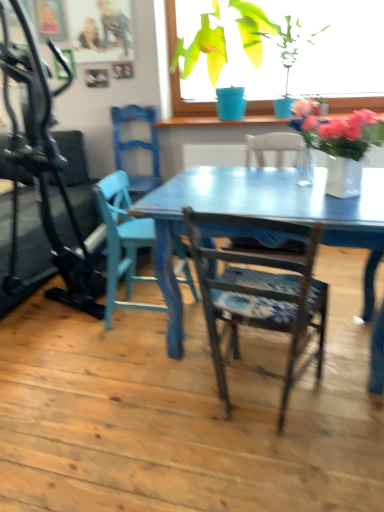
What do you see at coordinates (337, 130) in the screenshot? I see `white glossy vase at upper right, the 2th flower viewed from the right` at bounding box center [337, 130].

You are a GUI agent. You are given a task and a screenshot of the screen. Output one action in this format:
    pyautogui.click(x=<x>, y=<y>)
    Task: Click on the matte blue chair at left, the 3th chair viewed from the front
    The image size is (384, 512).
    Given the screenshot: What is the action you would take?
    pyautogui.click(x=137, y=145)

What is the approximate width of matte blue chair at left, the first chair viewed from the back?

19.34 inches.

What do you see at coordinates (195, 58) in the screenshot? This screenshot has width=384, height=512. I see `green matte plant pot at upper center, the second houseplant viewed from the right` at bounding box center [195, 58].

This screenshot has height=512, width=384. What are the coordinates of `green matte plant pot at upper center, the 1th houseplant from the left` in the screenshot? It's located at (195, 58).

You are a GUI agent. You are given a task and a screenshot of the screen. Output one action in this format:
    pyautogui.click(x=<x>, y=<y>)
    Task: Click on the blue painted wood chair at center, which is the 3th chair in back-to-front order
    The width and height of the screenshot is (384, 512).
    Given the screenshot: What is the action you would take?
    pyautogui.click(x=259, y=295)

Describe the element at coordinates (288, 47) in the screenshot. I see `green glossy plant at upper center, arranged as the 2th houseplant when viewed from the left` at that location.

Locate an element on the screen. This screenshot has width=384, height=512. green glossy plant at upper center, arranged as the 2th houseplant when viewed from the left is located at coordinates (288, 47).

Image resolution: width=384 pixels, height=512 pixels. Identify the location of black rubber treadmill at left. (44, 167).

From a real-world perspective, which object rests below the other?

matte blue chair at center, the second chair from the front, from a real-world perspective.

Consider the image. Is matte blue chair at center, the second chair from the back, situated inside green matte plant pot at upper center, the second houseplant viewed from the right, or outside?

matte blue chair at center, the second chair from the back, cannot be found inside green matte plant pot at upper center, the second houseplant viewed from the right.

Are matte blue chair at center, the second chair from the back, and green matte plant pot at upper center, the 1th houseplant from the left, making contact?

No, matte blue chair at center, the second chair from the back, is not with green matte plant pot at upper center, the 1th houseplant from the left.

Is matte blue chair at left, the 3th chair viewed from the front, inside the boundaries of green matte plant pot at upper center, the 1th houseplant from the left, or outside?

matte blue chair at left, the 3th chair viewed from the front, cannot be found inside green matte plant pot at upper center, the 1th houseplant from the left.

Is point (151, 145) less distant than point (257, 29)?

No.

From their relative heights in the image, would you say matte blue chair at left, the 3th chair viewed from the front, is taller or shorter than green matte plant pot at upper center, the second houseplant viewed from the right?

Considering their sizes, matte blue chair at left, the 3th chair viewed from the front, has less height than green matte plant pot at upper center, the second houseplant viewed from the right.

Is matte blue chair at left, the first chair viewed from the back, to the right of green matte plant pot at upper center, the second houseplant viewed from the right, from the viewer's perspective?

Incorrect, matte blue chair at left, the first chair viewed from the back, is not on the right side of green matte plant pot at upper center, the second houseplant viewed from the right.

Considering the sizes of objects matte blue chair at center, the second chair from the back, and blue painted wood chair at center, positioned as the 1th chair in front-to-back order, in the image provided, who is taller, matte blue chair at center, the second chair from the back, or blue painted wood chair at center, positioned as the 1th chair in front-to-back order,?

With more height is blue painted wood chair at center, positioned as the 1th chair in front-to-back order.

From the image's perspective, does matte blue chair at center, the second chair from the back, appear higher than blue painted wood chair at center, which is the 3th chair in back-to-front order?

Yes, from the image's perspective, matte blue chair at center, the second chair from the back, is on top of blue painted wood chair at center, which is the 3th chair in back-to-front order.

Can we say matte blue chair at center, the second chair from the back, lies outside blue painted wood chair at center, which is the 3th chair in back-to-front order?

Absolutely, matte blue chair at center, the second chair from the back, is external to blue painted wood chair at center, which is the 3th chair in back-to-front order.

Would you say green matte plant pot at upper center, the second houseplant viewed from the right, is inside or outside green glossy plant at upper center, arranged as the 2th houseplant when viewed from the left?

green matte plant pot at upper center, the second houseplant viewed from the right, can be found inside green glossy plant at upper center, arranged as the 2th houseplant when viewed from the left.

Based on their positions, is green matte plant pot at upper center, the second houseplant viewed from the right, located to the left or right of green glossy plant at upper center, which is counted as the first houseplant, starting from the right?

green matte plant pot at upper center, the second houseplant viewed from the right, is positioned on green glossy plant at upper center, which is counted as the first houseplant, starting from the right,'s left side.

From a real-world perspective, who is located higher, green matte plant pot at upper center, the second houseplant viewed from the right, or green glossy plant at upper center, arranged as the 2th houseplant when viewed from the left?

In real-world perspective, green matte plant pot at upper center, the second houseplant viewed from the right, is above.

Does point (193, 103) come farther from viewer compared to point (291, 52)?

Yes, it is.

How different are the orientations of black rubber treadmill at left and green matte plant pot at upper center, the 1th houseplant from the left, in degrees?

The angular difference between black rubber treadmill at left and green matte plant pot at upper center, the 1th houseplant from the left, is 0.413 degrees.

Considering the sizes of black rubber treadmill at left and green matte plant pot at upper center, the second houseplant viewed from the right, in the image, is black rubber treadmill at left taller or shorter than green matte plant pot at upper center, the second houseplant viewed from the right,?

In the image, black rubber treadmill at left appears to be taller than green matte plant pot at upper center, the second houseplant viewed from the right.

Is black rubber treadmill at left placed right next to green matte plant pot at upper center, the 1th houseplant from the left?

black rubber treadmill at left is not next to green matte plant pot at upper center, the 1th houseplant from the left, and they're not touching.

Is black rubber treadmill at left situated inside green matte plant pot at upper center, the 1th houseplant from the left, or outside?

black rubber treadmill at left is spatially situated outside green matte plant pot at upper center, the 1th houseplant from the left.

How far apart are white glossy vase at upper right, arranged as the 1th flower when viewed from the front, and green matte plant pot at upper center, the 1th houseplant from the left?

white glossy vase at upper right, arranged as the 1th flower when viewed from the front, and green matte plant pot at upper center, the 1th houseplant from the left, are 4.97 feet apart from each other.

From the image's perspective, is white glossy vase at upper right, the 2th flower viewed from the right, located above green matte plant pot at upper center, the 1th houseplant from the left?

No, from the image's perspective, white glossy vase at upper right, the 2th flower viewed from the right, is not above green matte plant pot at upper center, the 1th houseplant from the left.

Between white glossy vase at upper right, which ranks as the 1th flower in left-to-right order, and green matte plant pot at upper center, the 1th houseplant from the left, which one has larger width?

Wider between the two is green matte plant pot at upper center, the 1th houseplant from the left.

Is green matte plant pot at upper center, the second houseplant viewed from the right, located within white glossy vase at upper right, which ranks as the 1th flower in left-to-right order?

Definitely not — green matte plant pot at upper center, the second houseplant viewed from the right, is not inside white glossy vase at upper right, which ranks as the 1th flower in left-to-right order.

In the scene shown: Could you tell me if green matte plant pot at upper center, the second houseplant viewed from the right, is facing matte blue chair at center, the second chair from the front?

Yes, green matte plant pot at upper center, the second houseplant viewed from the right, is oriented towards matte blue chair at center, the second chair from the front.

Is green matte plant pot at upper center, the second houseplant viewed from the right, bigger than matte blue chair at center, the second chair from the back?

Yes.

In the scene shown: Which object is thinner, green matte plant pot at upper center, the 1th houseplant from the left, or matte blue chair at center, the second chair from the front?

matte blue chair at center, the second chair from the front.

Starting from the matte blue chair at center, the second chair from the front, which houseplant is the 1st one to the right? Please provide its 2D coordinates.

[(195, 58)]

Image resolution: width=384 pixels, height=512 pixels. I want to click on houseplant that is the 2nd object located behind the matte blue chair at center, the second chair from the front, so click(195, 58).

The width and height of the screenshot is (384, 512). I want to click on the 2nd houseplant above the matte blue chair at left, the 3th chair viewed from the front (from the image's perspective), so click(x=195, y=58).

Estimate the real-world distances between objects in this image. Which object is closer to matte blue chair at left, the 3th chair viewed from the front, pink matte vase at upper center, positioned as the second flower in front-to-back order, or white glossy vase at upper right, placed as the 1th flower when sorted from bottom to top?

Among the two, pink matte vase at upper center, positioned as the second flower in front-to-back order, is located nearer to matte blue chair at left, the 3th chair viewed from the front.

Considering their positions, is black rubber treadmill at left positioned closer to green matte plant pot at upper center, the 1th houseplant from the left, than matte blue chair at center, the second chair from the front?

The object closer to green matte plant pot at upper center, the 1th houseplant from the left, is black rubber treadmill at left.

Looking at the image, which one is located further to blue painted wood chair at center, which is the 3th chair in back-to-front order, matte blue chair at left, the 3th chair viewed from the front, or matte blue chair at center, the second chair from the front?

The object further to blue painted wood chair at center, which is the 3th chair in back-to-front order, is matte blue chair at left, the 3th chair viewed from the front.

Estimate the real-world distances between objects in this image. Which object is further from green glossy plant at upper center, arranged as the 2th houseplant when viewed from the left, blue painted wood chair at center, which is the 3th chair in back-to-front order, or green matte plant pot at upper center, the 1th houseplant from the left?

Based on the image, blue painted wood chair at center, which is the 3th chair in back-to-front order, appears to be further to green glossy plant at upper center, arranged as the 2th houseplant when viewed from the left.

Looking at the image, which one is located further to green glossy plant at upper center, arranged as the 2th houseplant when viewed from the left, blue painted wood chair at center, positioned as the 1th chair in front-to-back order, or matte blue chair at left, the first chair viewed from the back?

blue painted wood chair at center, positioned as the 1th chair in front-to-back order, is positioned further to the anchor green glossy plant at upper center, arranged as the 2th houseplant when viewed from the left.

Looking at the image, which one is located further to green matte plant pot at upper center, the second houseplant viewed from the right, matte blue chair at left, the first chair viewed from the back, or pink matte vase at upper center, the 1th flower in the right-to-left sequence?

Based on the image, pink matte vase at upper center, the 1th flower in the right-to-left sequence, appears to be further to green matte plant pot at upper center, the second houseplant viewed from the right.

Looking at the image, which one is located further to white glossy vase at upper right, the second flower from the top, matte blue chair at center, the second chair from the back, or matte blue chair at left, the first chair viewed from the back?

Among the two, matte blue chair at left, the first chair viewed from the back, is located further to white glossy vase at upper right, the second flower from the top.

Based on the photo, estimate the real-world distances between objects in this image. Which object is further from black rubber treadmill at left, green matte plant pot at upper center, the second houseplant viewed from the right, or blue painted wood chair at center, which is the 3th chair in back-to-front order?

Based on the image, green matte plant pot at upper center, the second houseplant viewed from the right, appears to be further to black rubber treadmill at left.

Find the location of a particular element. flower located between black rubber treadmill at left and green glossy plant at upper center, arranged as the 2th houseplant when viewed from the left, in the left-right direction is located at coordinates (337, 130).

Where is `flower located between blue painted wood chair at center, which is the 3th chair in back-to-front order, and pink matte vase at upper center, the 1th flower positioned from the top, in the depth direction`? This screenshot has width=384, height=512. flower located between blue painted wood chair at center, which is the 3th chair in back-to-front order, and pink matte vase at upper center, the 1th flower positioned from the top, in the depth direction is located at coordinates (337, 130).

Where is `houseplant between black rubber treadmill at left and green glossy plant at upper center, which is counted as the first houseplant, starting from the right`? Image resolution: width=384 pixels, height=512 pixels. houseplant between black rubber treadmill at left and green glossy plant at upper center, which is counted as the first houseplant, starting from the right is located at coordinates (195, 58).

Where is `houseplant between black rubber treadmill at left and blue painted wood chair at center, positioned as the 1th chair in front-to-back order`? houseplant between black rubber treadmill at left and blue painted wood chair at center, positioned as the 1th chair in front-to-back order is located at coordinates (195, 58).